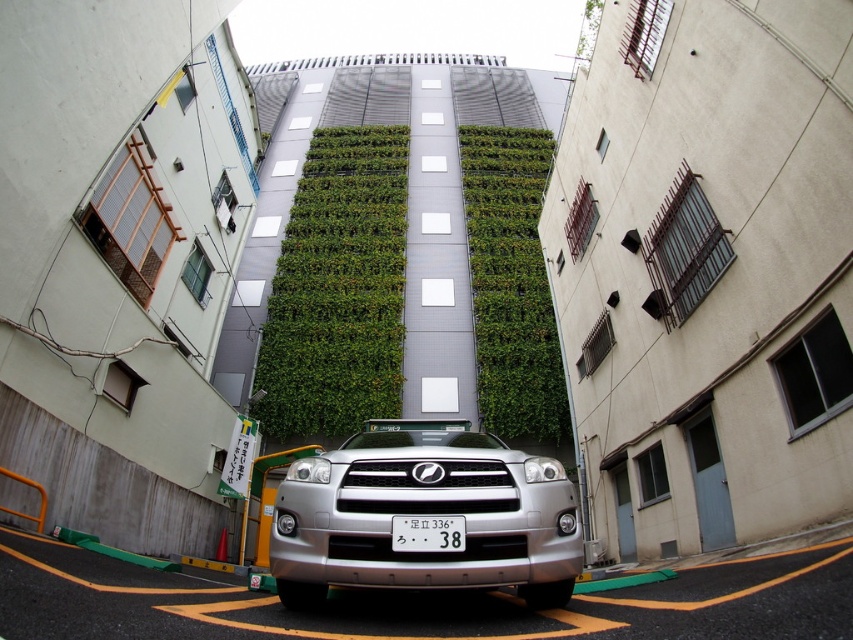
You are a pedestrian standing on the sidewalk and want to cross the street. There is a silver metallic car at center and a green leafy wall at center in your view. Which object is closer to the sidewalk?

The green leafy wall at center is closer to the sidewalk since the silver metallic car at center is positioned to the right of it, implying the car is further away from the pedestrian.

You are standing at point (x=555, y=579) and want to walk to the silver SUV parked on the road. Is the point (x=483, y=600) between you and the SUV?

Point (x=483, y=600) is behind point (x=555, y=579), so it is not between you and the SUV. You can walk directly to the SUV without encountering the point (x=483, y=600) along your path.

You are a delivery person trying to park your silver metallic car at center between two other vehicles. The space available is narrower than the width of the green leafy wall at center. Can your car fit in the space?

The silver metallic car at center is thinner than the green leafy wall at center. Since the available space is narrower than the width of the green leafy wall at center, the car may not fit as it might still be too wide for the space.